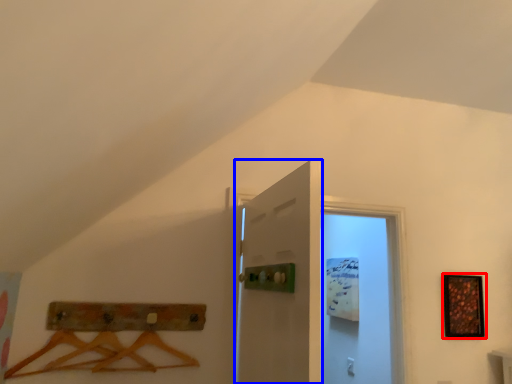
Question: Which point is further to the camera, picture frame (highlighted by a red box) or door (highlighted by a blue box)?

Choices:
 (A) picture frame
 (B) door

Answer: (A)